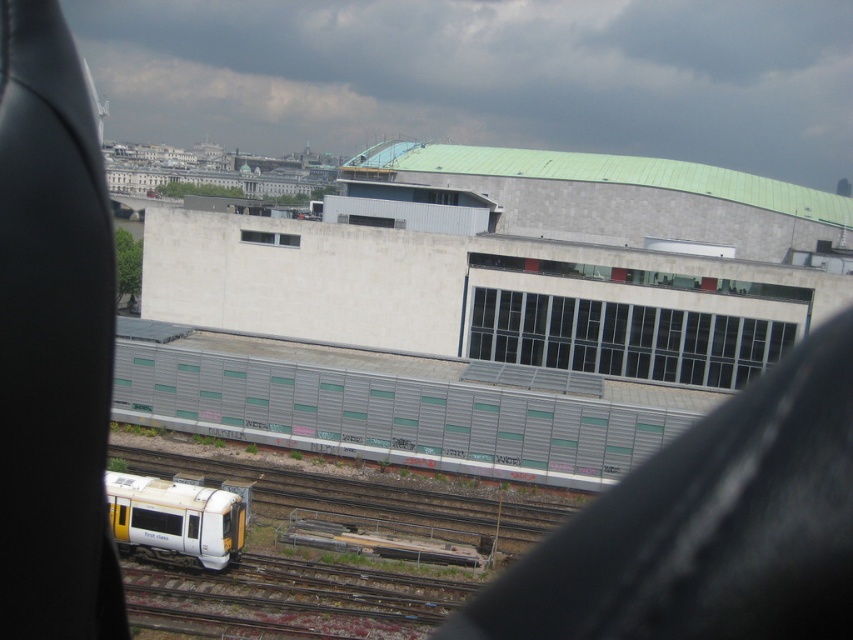
Consider the image. Does white glossy passenger train at lower left lie in front of transparent glass window at center?

Yes.

Is point (117, 493) less distant than point (274, 237)?

Yes, it is in front of point (274, 237).

You are a GUI agent. You are given a task and a screenshot of the screen. Output one action in this format:
    pyautogui.click(x=<x>, y=<y>)
    Task: Click on the white glossy passenger train at lower left
    
    Given the screenshot: What is the action you would take?
    175,520

Does metallic gray train at center lie behind transparent glass window at center?

No, metallic gray train at center is closer to the viewer.

Between point (309, 445) and point (267, 237), which one is positioned in front?

Positioned in front is point (309, 445).

Identify the location of metallic gray train at center. Image resolution: width=853 pixels, height=640 pixels. (395, 404).

Does metallic gray train at center appear on the left side of transparent glass windows at center?

Correct, you'll find metallic gray train at center to the left of transparent glass windows at center.

Measure the distance between metallic gray train at center and camera.

metallic gray train at center is 59.52 meters away from camera.

I want to click on metallic gray train at center, so click(395, 404).